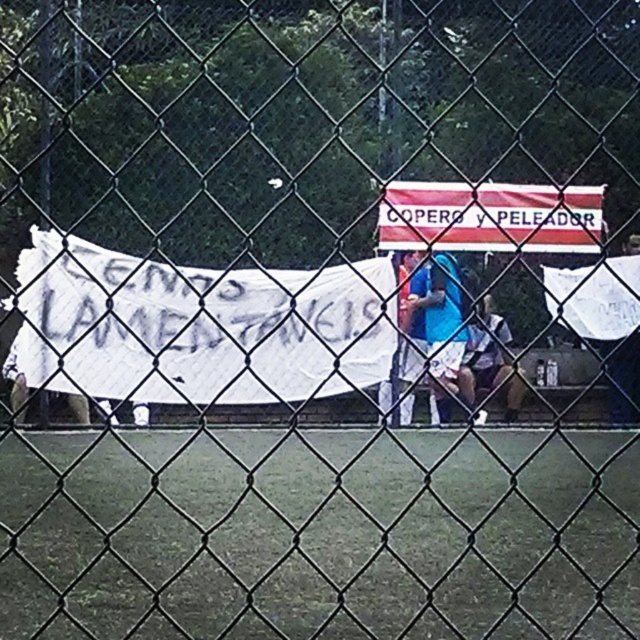
Question: Is white paper banner at center further to camera compared to blue fabric shirt at center?

Choices:
 (A) yes
 (B) no

Answer: (A)

Question: Which point is closer to the camera?

Choices:
 (A) (426, 300)
 (B) (504, 355)
 (C) (60, 272)

Answer: (C)

Question: Can you confirm if white paper banner at center is thinner than white fabric shirt at center?

Choices:
 (A) no
 (B) yes

Answer: (B)

Question: Which object is closer to the camera taking this photo?

Choices:
 (A) white paper banner at center
 (B) white fabric shirt at center
 (C) blue fabric shirt at center

Answer: (C)

Question: Does white paper banner at center appear on the right side of blue fabric shirt at center?

Choices:
 (A) no
 (B) yes

Answer: (A)

Question: Which object appears closest to the camera in this image?

Choices:
 (A) blue fabric shirt at center
 (B) white paper banner at center
 (C) white fabric shirt at center

Answer: (A)